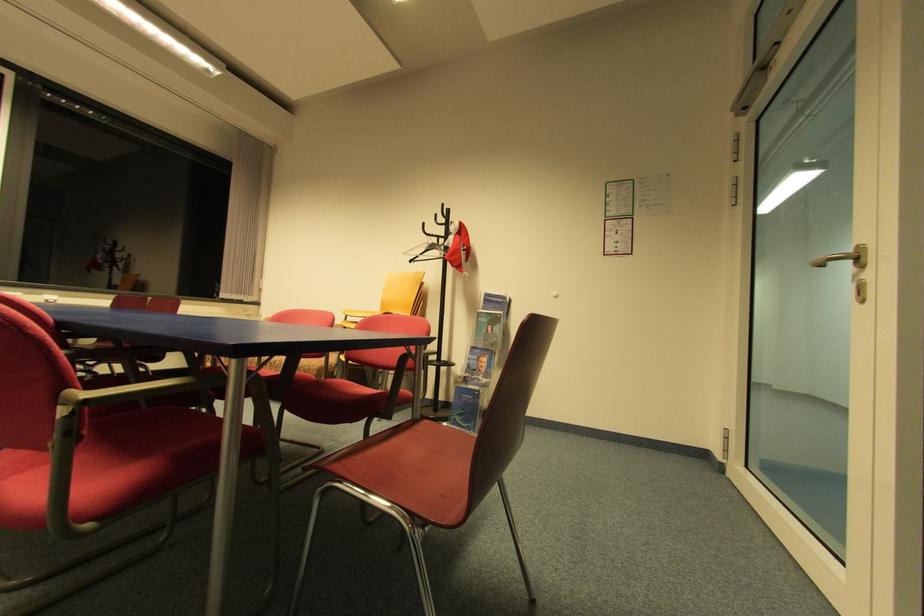
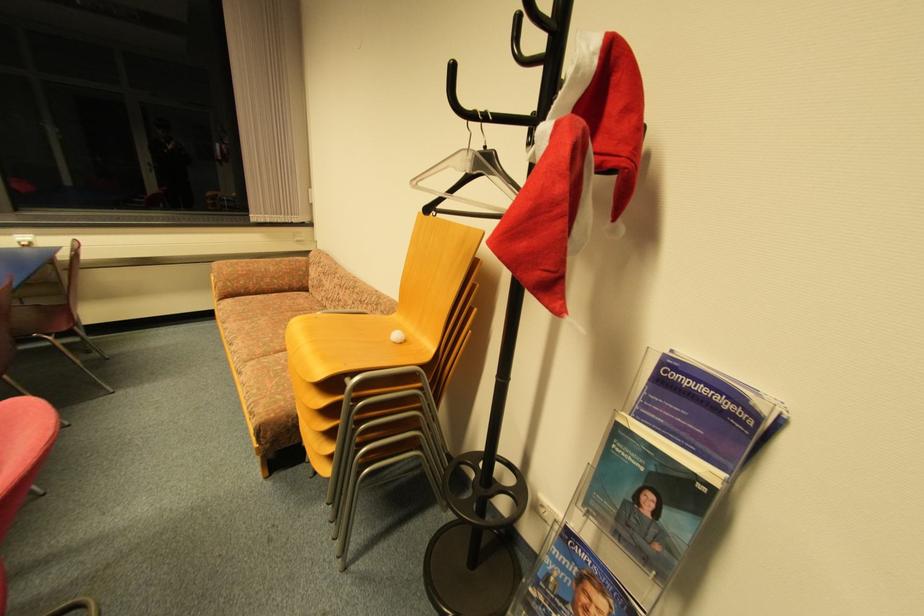
Find the pixel in the second image that matches [499,301] in the first image.

(708, 391)